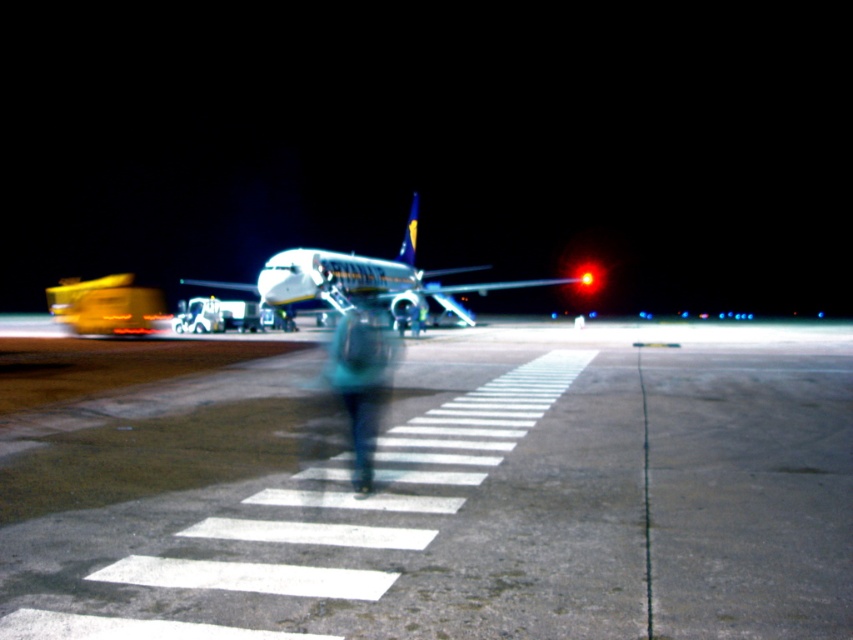
You are a pedestrian standing at the edge of the tarmac. You see the white painted lines at center and the white glossy airplane at center. Which object is closer to you?

The white painted lines at center are closer to the viewer than the white glossy airplane at center.

Looking at this image, you are standing at the pedestrian crossing marked by white stripes in the foreground of the airport tarmac scene. You see a point labeled as point [364,282]. What object is this point located on?

The point [364,282] is located on the white glossy airplane at center.